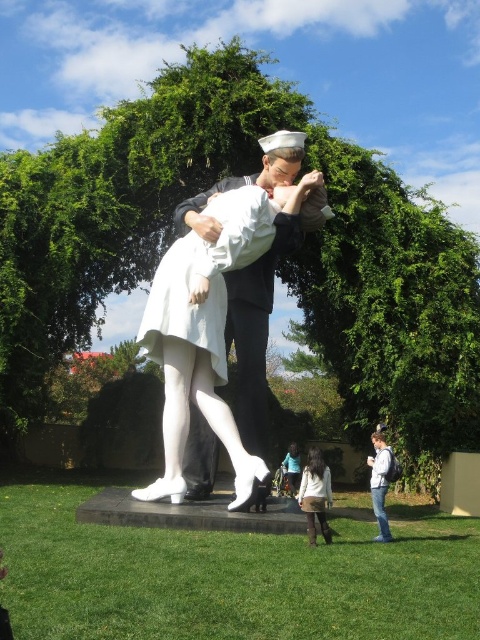
Question: Which point is closer to the camera taking this photo?

Choices:
 (A) (316, 513)
 (B) (299, 474)
 (C) (167, 337)

Answer: (A)

Question: Can you confirm if white matte skirt at lower center is smaller than white matte dress at center?

Choices:
 (A) yes
 (B) no

Answer: (A)

Question: Can you confirm if white glossy statue at center is positioned below white matte dress at center?

Choices:
 (A) no
 (B) yes

Answer: (A)

Question: Considering the relative positions of white glossy statue at center and white matte dress at center in the image provided, where is white glossy statue at center located with respect to white matte dress at center?

Choices:
 (A) right
 (B) left

Answer: (B)

Question: Which object is closer to the camera taking this photo?

Choices:
 (A) white matte dress at center
 (B) white matte skirt at lower center
 (C) white glossy statue at center

Answer: (B)

Question: Which point appears farthest from the camera in this image?

Choices:
 (A) (290, 448)
 (B) (238, 269)
 (C) (312, 490)

Answer: (A)